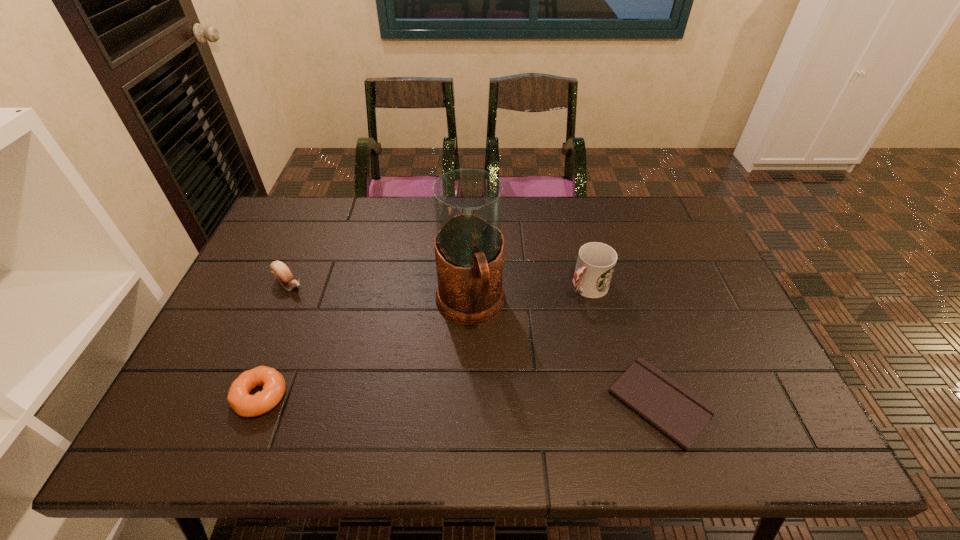
The width and height of the screenshot is (960, 540). Identify the location of escargot that is at the left edge. (280, 271).

The image size is (960, 540). I want to click on object present at the near left corner, so click(x=274, y=386).

Where is `free space at the far edge of the desktop`? free space at the far edge of the desktop is located at coordinates (399, 199).

The width and height of the screenshot is (960, 540). Identify the location of vacant space at the near edge. (612, 400).

Find the location of a particular element. This screenshot has height=540, width=960. vacant space at the left edge of the desktop is located at coordinates tap(254, 309).

Identify the location of blank space at the right edge. (703, 258).

In the image, there is a desktop. Where is `vacant space at the far left corner`? This screenshot has width=960, height=540. vacant space at the far left corner is located at coordinates (304, 204).

Locate an element on the screen. The image size is (960, 540). blank space at the far right corner is located at coordinates (643, 222).

Where is `free spot between the cup and the shortest object`? The width and height of the screenshot is (960, 540). free spot between the cup and the shortest object is located at coordinates (623, 346).

This screenshot has width=960, height=540. In order to click on free area in between the tallest object and the cup in this screenshot , I will do `click(529, 297)`.